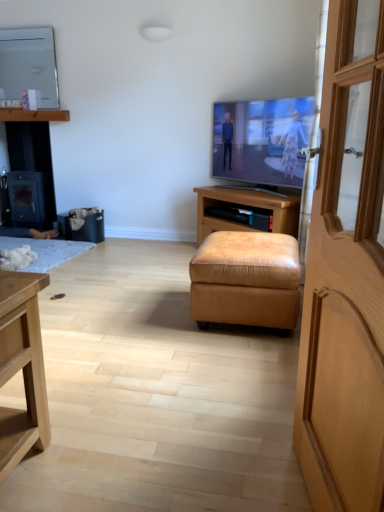
The width and height of the screenshot is (384, 512). In order to click on vacant space situated above wooden shelf at upper left, the second cabinetry from the bottom (from a real-world perspective) in this screenshot , I will do `click(41, 105)`.